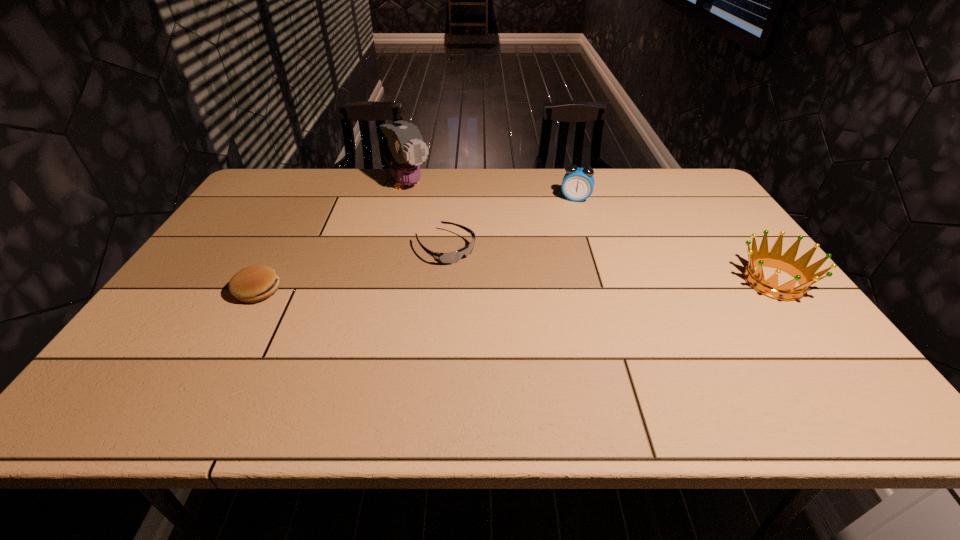
Locate an element on the screen. Image resolution: width=960 pixels, height=540 pixels. the leftmost object is located at coordinates (255, 283).

Locate an element on the screen. The width and height of the screenshot is (960, 540). patty is located at coordinates (255, 283).

This screenshot has height=540, width=960. Identify the location of the third shortest object. (805, 276).

At what (x,y) coordinates should I click in order to perform the action: click on crown. Please return your answer as a coordinate pair (x, y). Looking at the image, I should click on (805, 276).

Image resolution: width=960 pixels, height=540 pixels. In order to click on bird in this screenshot , I will do `click(406, 150)`.

Where is `the shortest object`? the shortest object is located at coordinates (452, 257).

Locate an element on the screen. The height and width of the screenshot is (540, 960). the fourth object from left to right is located at coordinates (578, 183).

Locate an element on the screen. The image size is (960, 540). alarm clock is located at coordinates (578, 183).

Locate an element on the screen. This screenshot has width=960, height=540. vacant region located on the right of the fourth tallest object is located at coordinates pos(339,291).

At what (x,y) coordinates should I click in order to perform the action: click on free spot located 0.250m on the back of the rightmost object. Please return your answer as a coordinate pair (x, y). The image size is (960, 540). Looking at the image, I should click on (720, 210).